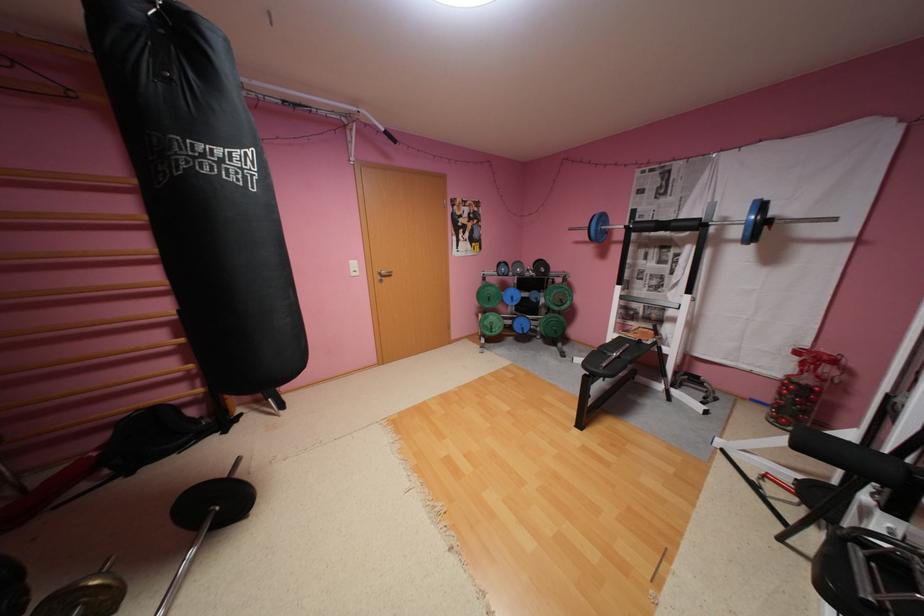
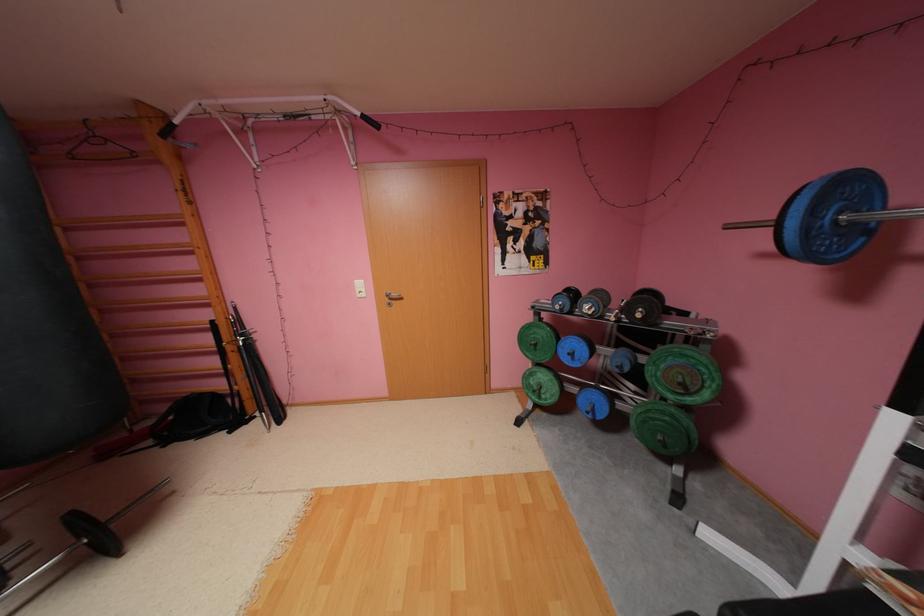
Locate, in the second image, the point that corresponds to (x=391, y=276) in the first image.

(399, 299)